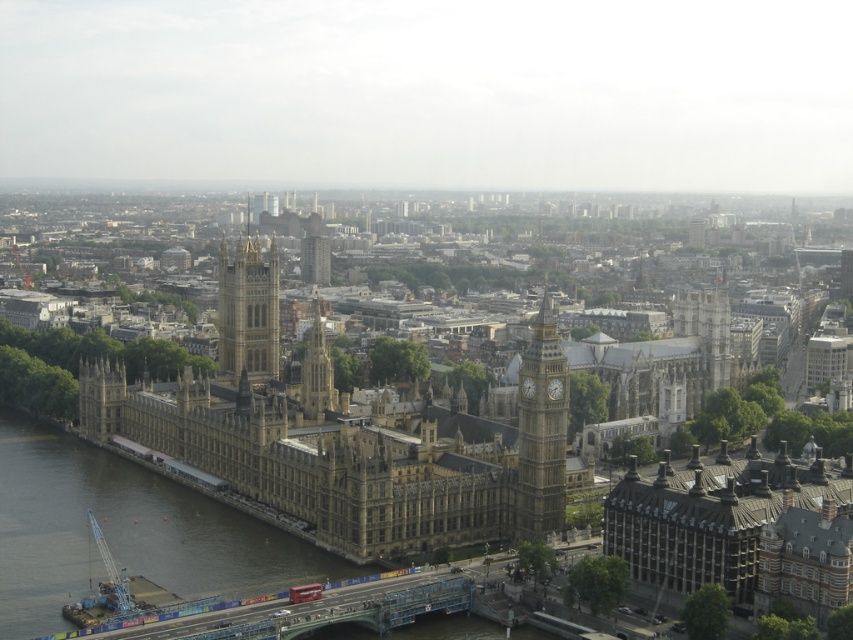
You are a tourist standing at the center of the image, looking towards the Houses of Parliament. Which direction should you walk to reach the smooth concrete waterway at lower left?

The smooth concrete waterway at lower left is located at coordinates point (x=125, y=531), so you should walk to the lower left direction to reach it.